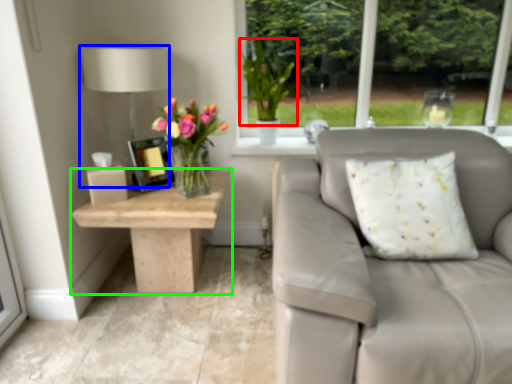
Question: Based on their relative distances, which object is farther from floral arrangement (highlighted by a red box)? Choose from table lamp (highlighted by a blue box) and table (highlighted by a green box).

Choices:
 (A) table lamp
 (B) table

Answer: (B)